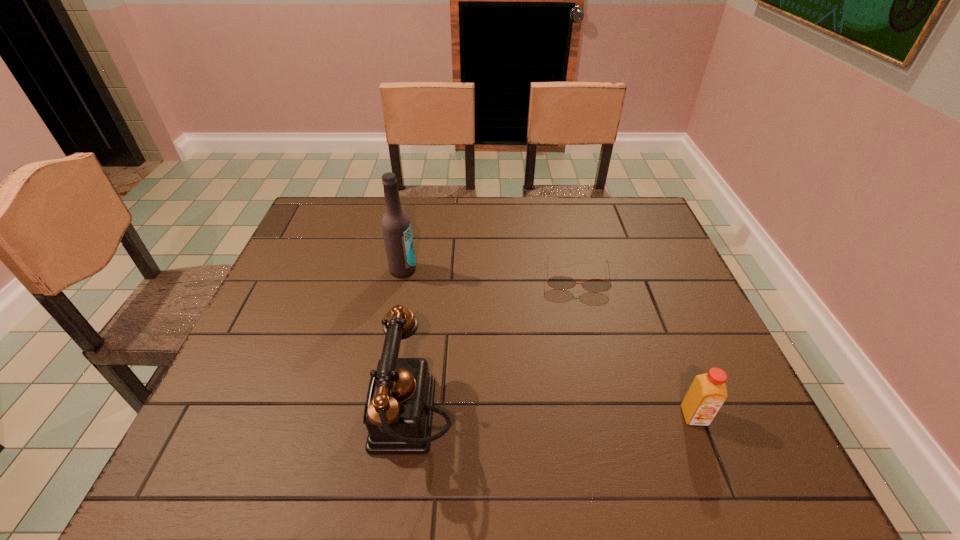
You are a GUI agent. You are given a task and a screenshot of the screen. Output one action in this format:
    pyautogui.click(x=<x>, y=<y>)
    Task: Click on the vacant region at the left edge of the desktop
    The width and height of the screenshot is (960, 540).
    Given the screenshot: What is the action you would take?
    pos(320,296)

In the image, there is a desktop. Where is `vacant space at the right edge`? The image size is (960, 540). vacant space at the right edge is located at coordinates [715, 341].

In the image, there is a desktop. At what (x,y) coordinates should I click in order to perform the action: click on free space at the far left corner. Please return your answer as a coordinate pair (x, y). Image resolution: width=960 pixels, height=540 pixels. Looking at the image, I should click on (309, 238).

Locate an element on the screen. free space at the far right corner is located at coordinates (612, 197).

You are a GUI agent. You are given a task and a screenshot of the screen. Output one action in this format:
    pyautogui.click(x=<x>, y=<y>)
    Task: Click on the free point between the second shortest object and the telephone
    Image resolution: width=960 pixels, height=540 pixels.
    Given the screenshot: What is the action you would take?
    pyautogui.click(x=552, y=417)

You are a GUI agent. You are given a task and a screenshot of the screen. Output one action in this format:
    pyautogui.click(x=<x>, y=<y>)
    Task: Click on the vacant area between the rightmost object and the sunglasses
    The height and width of the screenshot is (540, 960).
    Given the screenshot: What is the action you would take?
    pyautogui.click(x=636, y=346)

Find the location of a particular element. The image size is (960, 540). vacant space in between the telephone and the orange juice is located at coordinates (552, 417).

This screenshot has width=960, height=540. I want to click on free spot between the second tallest object and the second shortest object, so click(x=552, y=417).

Where is `blank region between the orange juice and the second tallest object`? Image resolution: width=960 pixels, height=540 pixels. blank region between the orange juice and the second tallest object is located at coordinates (552, 417).

Identify the location of free spot between the third shortest object and the beer bottle. pyautogui.click(x=407, y=345).